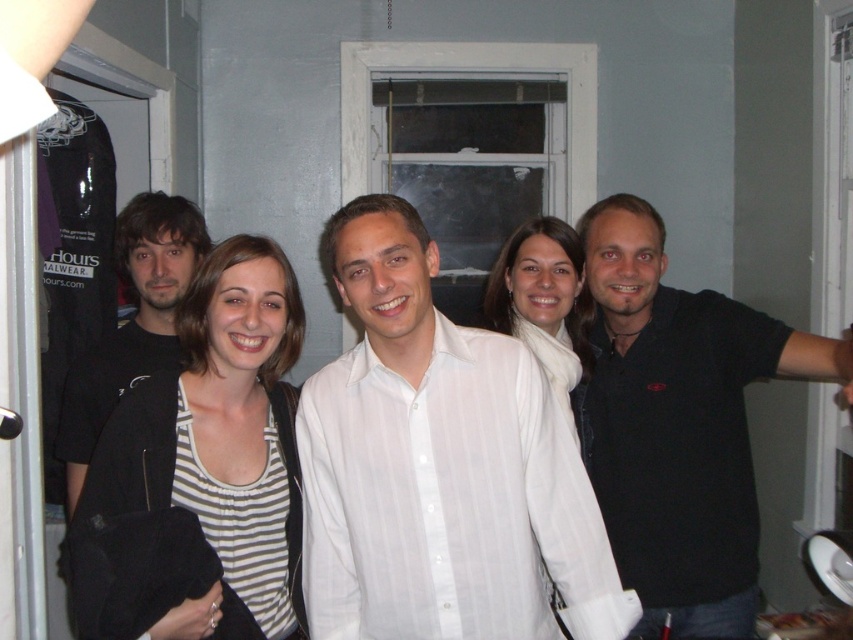
You are standing in the room where the group photo was taken. You want to place a small decorative item exactly at the point with coordinates point (328, 253). If you are holding the item at eye level, which is 1.6 meters above the floor, will you need to bend down to place it there?

The distance of point (328, 253) from camera is 1.49 meters, but the question does not provide information about the height of the point relative to the floor. Therefore, it is impossible to determine if bending down is necessary based on the given information.

You are standing in the room where this photo was taken and want to hand a gift to the person wearing the striped fabric shirt at center without disturbing the person in the white sheer shirt at center. How can you do this?

Since the striped fabric shirt at center is closer to the viewer than the white sheer shirt at center, you can approach the striped fabric shirt at center directly from the front without needing to move around the white sheer shirt at center, ensuring you don

You are a photographer trying to decide how to frame a group photo. You have two shirts in view, the white striped shirt at center and the black matte shirt at right. Which shirt should you zoom in on to capture more details of the fabric patterns?

The white striped shirt at center has a greater width than the black matte shirt at right, so zooming in on the white striped shirt at center would allow you to capture more details of its fabric patterns due to its larger size.